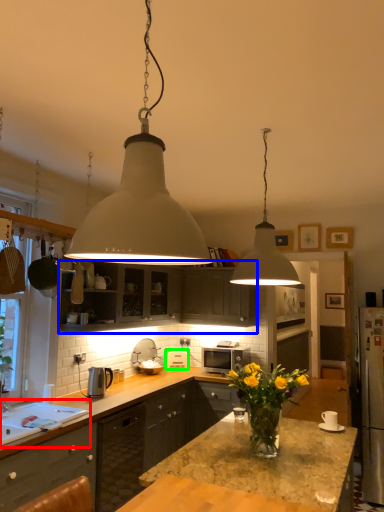
Question: Which object is the farthest from sink (highlighted by a red box)? Choose among these: cabinetry (highlighted by a blue box) or appliance (highlighted by a green box).

Choices:
 (A) cabinetry
 (B) appliance

Answer: (B)